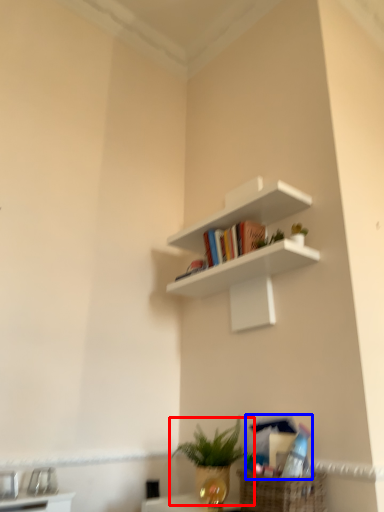
Question: Which of the following is the farthest to the observer, houseplant (highlighted by a red box) or book (highlighted by a blue box)?

Choices:
 (A) houseplant
 (B) book

Answer: (A)